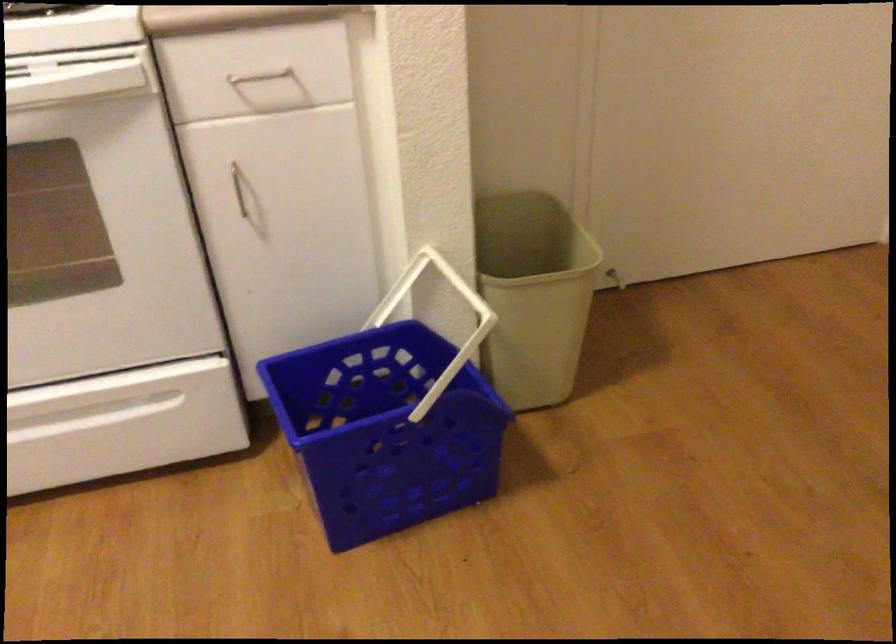
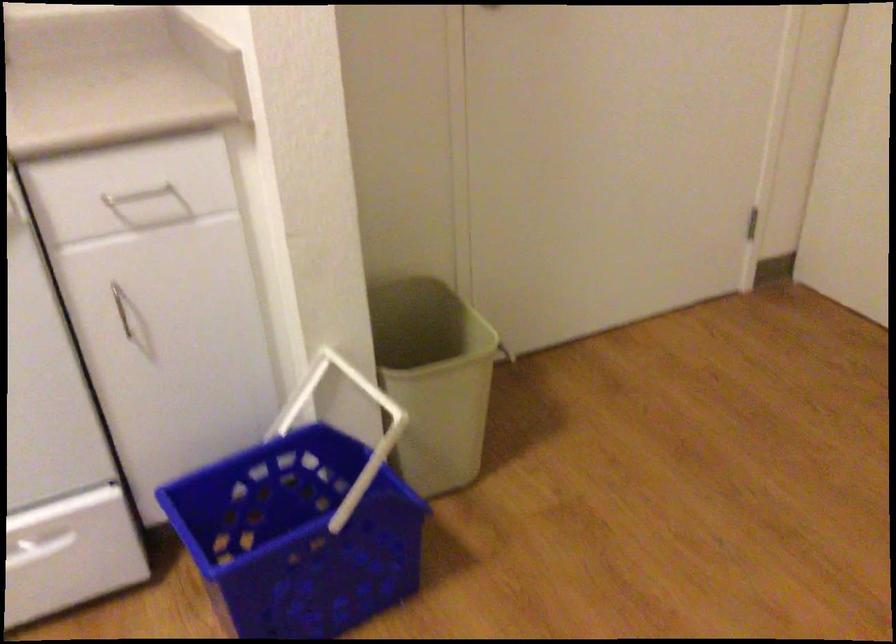
Locate, in the second image, the point that corresponds to (440,305) in the first image.

(343, 402)